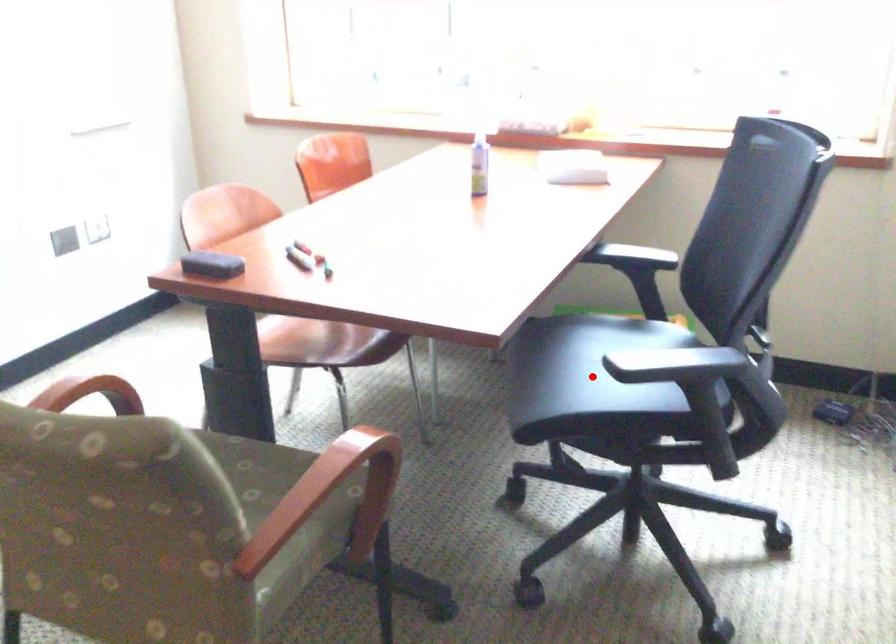
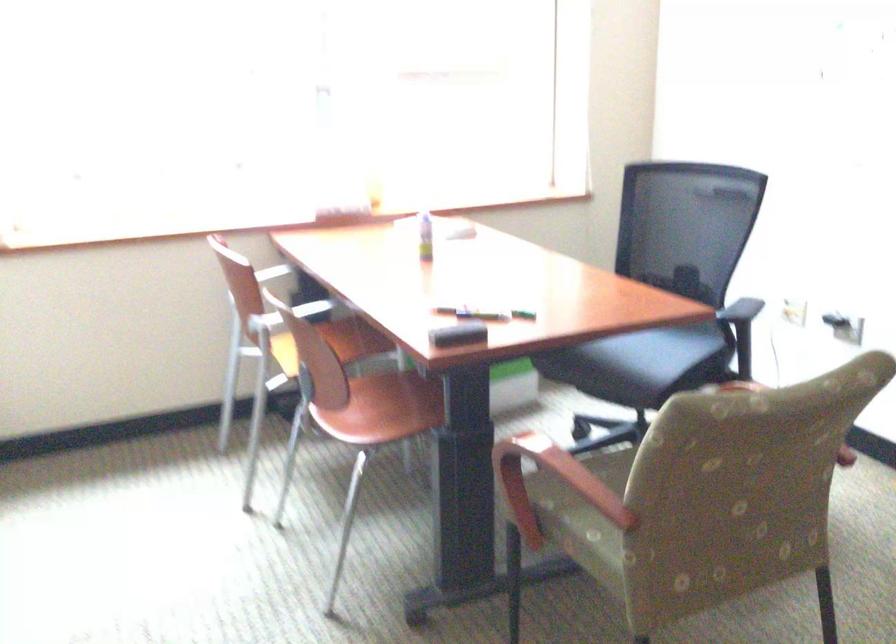
The point at the highlighted location is marked in the first image. Where is the corresponding point in the second image?

(649, 348)